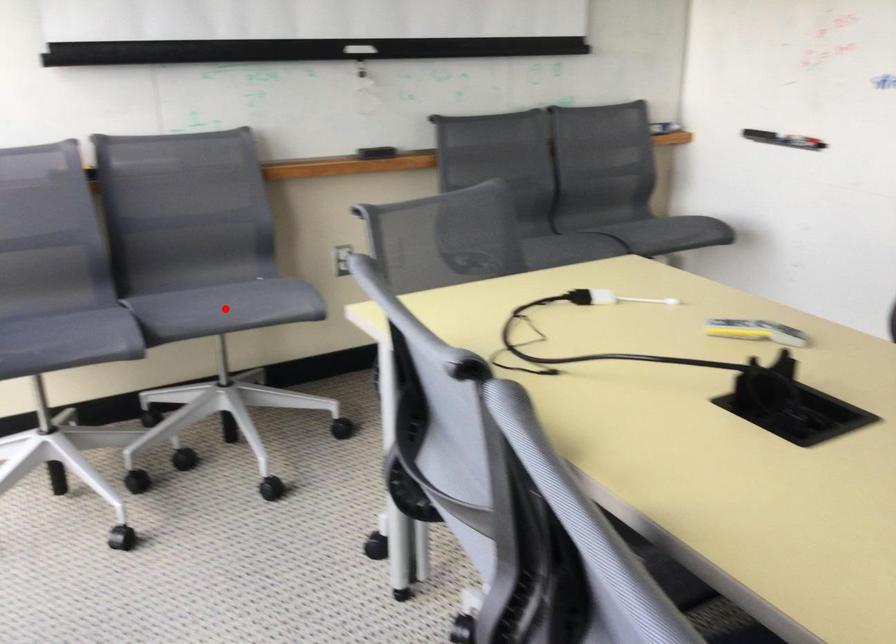
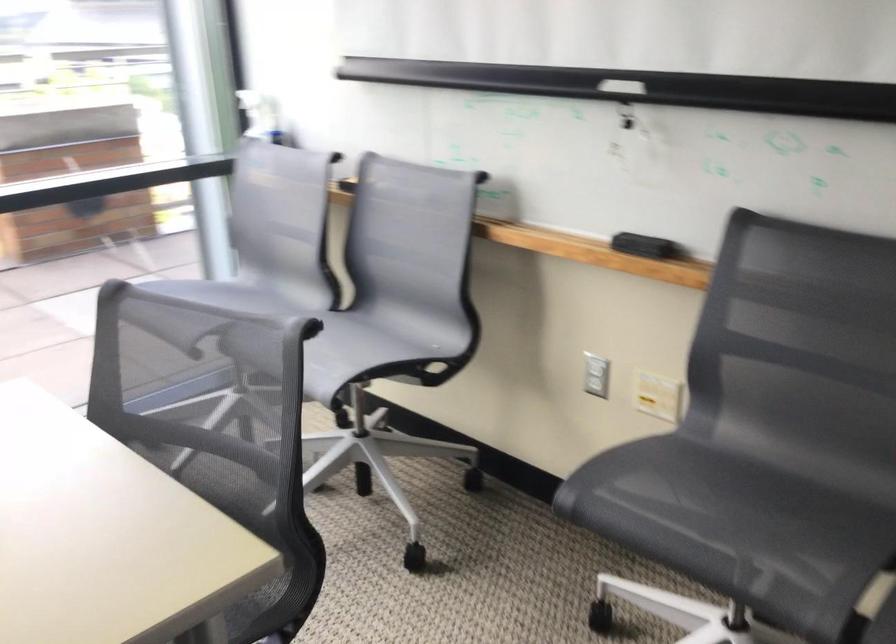
Question: I am providing you with two images of the same scene from different viewpoints. A red point is marked on the first image. At the location where the point appears in image 1, is it still visible in image 2?

Choices:
 (A) Yes
 (B) No

Answer: (B)